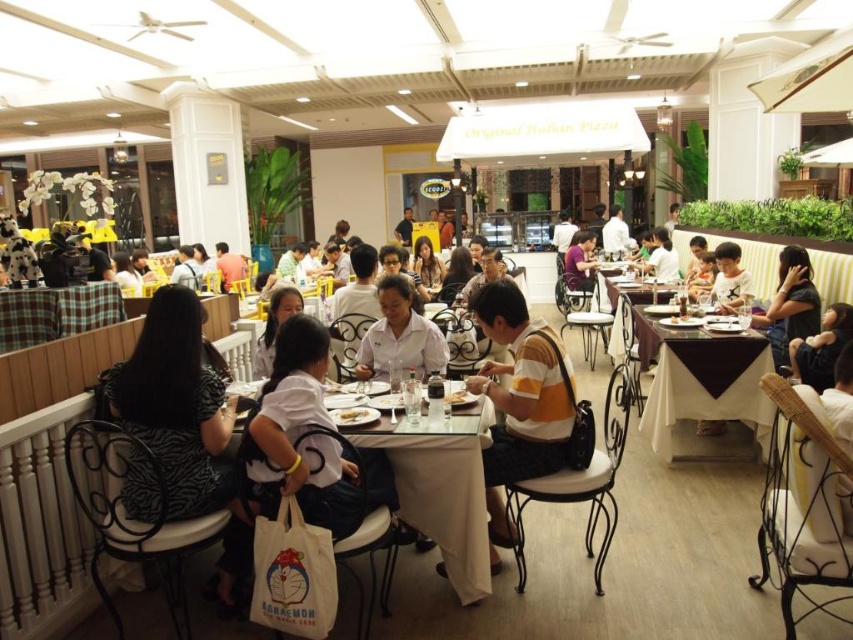
Between point (488, 365) and point (401, 323), which one is positioned behind?

The point (401, 323) is more distant.

Who is higher up, yellow-orange striped shirt at center or white matte shirt at center?

Positioned higher is white matte shirt at center.

Which is in front, point (537, 401) or point (402, 291)?

Positioned in front is point (537, 401).

I want to click on yellow-orange striped shirt at center, so click(519, 401).

Who is positioned more to the right, zebra print dress at left or yellow-orange striped shirt at center?

From the viewer's perspective, yellow-orange striped shirt at center appears more on the right side.

Identify the location of zebra print dress at left. (184, 422).

Does white matte shirt at center have a larger size compared to dark brown leather jacket at lower right?

Indeed, white matte shirt at center has a larger size compared to dark brown leather jacket at lower right.

Which is more to the left, white matte shirt at center or dark brown leather jacket at lower right?

white matte shirt at center is more to the left.

Locate an element on the screen. This screenshot has width=853, height=640. white matte shirt at center is located at coordinates (399, 336).